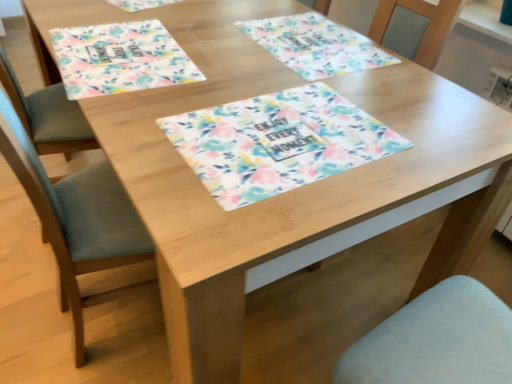
Find the location of a particular element. The width and height of the screenshot is (512, 384). vacant area that lies in front of floral fabric placemat at center, positioned as the second place mat in left-to-right order is located at coordinates (316, 107).